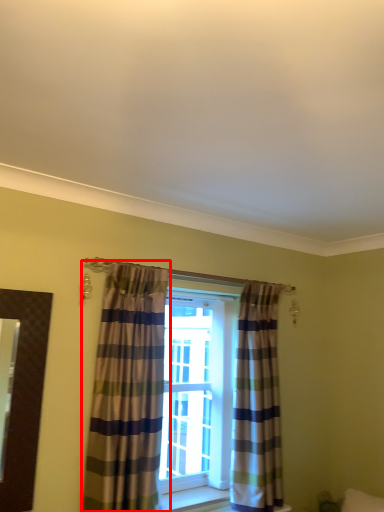
Question: From the image's perspective, where is curtain (annotated by the red box) located in relation to curtain in the image?

Choices:
 (A) below
 (B) above

Answer: (B)